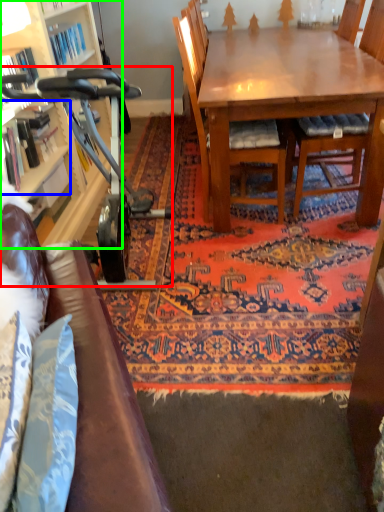
Question: Which object is positioned closest to baby carriage (highlighted by a red box)? Select from shelf (highlighted by a blue box) and cabinetry (highlighted by a green box).

Choices:
 (A) shelf
 (B) cabinetry

Answer: (A)